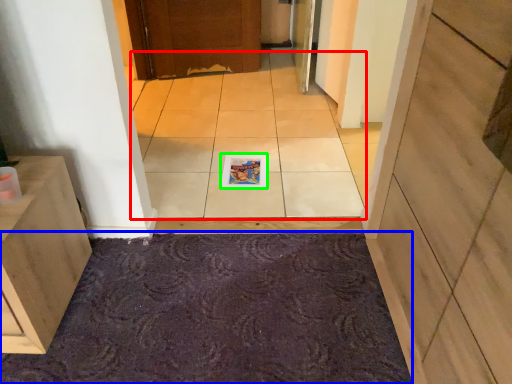
Question: Which is farther away from ceramic tile (highlighted by a red box)? bath mat (highlighted by a blue box) or magazine (highlighted by a green box)?

Choices:
 (A) bath mat
 (B) magazine

Answer: (A)